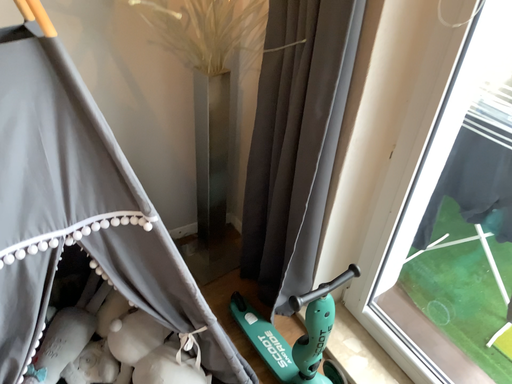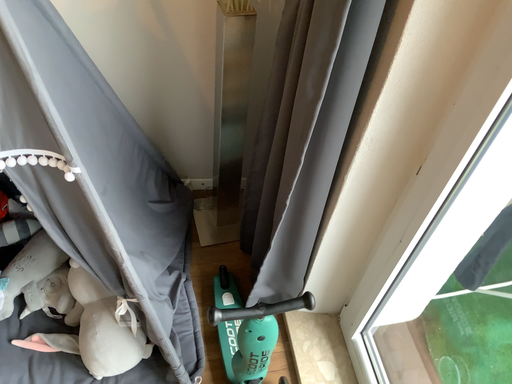
Question: Which way did the camera rotate in the video?

Choices:
 (A) rotated left
 (B) rotated right

Answer: (A)